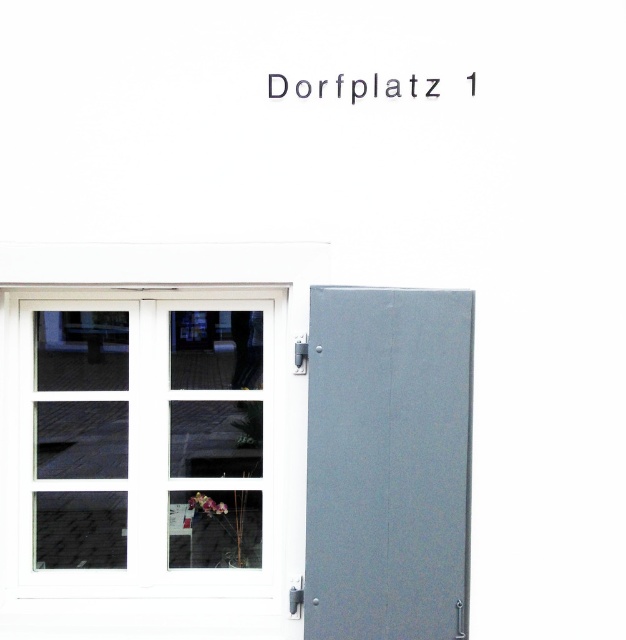
You are a delivery person trying to enter the building. You see the white glass window at center and the gray matte door at right. Which object should you approach to find the door?

You should approach the gray matte door at right to find the door, as the white glass window at center is located to its left.

In the scene shown: You are standing in front of the building shown in the image. There are two points marked on the facade. The first point is at coordinates point (53, 368) and the second is at point (377, 609). If you were to walk directly towards the building, which point would you encounter first?

Point (53, 368) is behind point (377, 609), so you would encounter point (377, 609) first as you walk towards the building.

You are a delivery person trying to reach the entrance of the building. You see the white glass window at center and the gray matte door at right. Which object is closer to you as you approach the building?

The white glass window at center is closer to you than the gray matte door at right, so you should approach the white glass window at center first to reach the entrance.